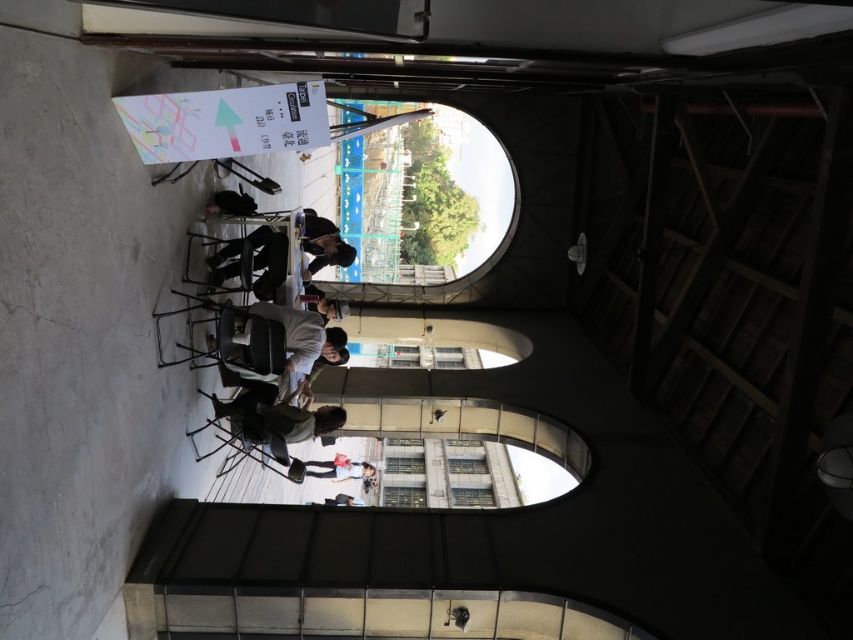
You are attending an event in this space and notice two fabrics displayed. The green fabric shirt at lower center and the light pink fabric at center. Which fabric is positioned to the right of the other?

The green fabric shirt at lower center is to the right of the light pink fabric at center.

In the scene shown: You are standing in the room and want to place a small plant between the green fabric shirt at lower center and the light pink fabric at center. According to their positions, where should you place the plant?

The green fabric shirt at lower center is located above the light pink fabric at center, so you should place the plant between them by positioning it below the green fabric shirt at lower center and above the light pink fabric at center.